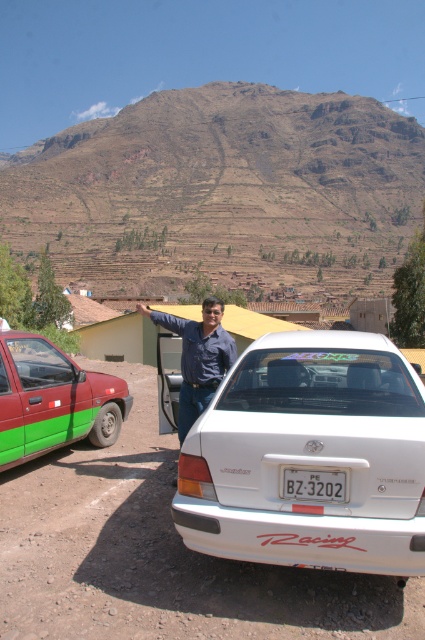
Can you confirm if green matte car at left is positioned to the left of white plastic license plate at center?

Indeed, green matte car at left is positioned on the left side of white plastic license plate at center.

Which is in front, point (25, 381) or point (283, 476)?

Point (283, 476)

The image size is (425, 640). I want to click on green matte car at left, so click(x=53, y=400).

Between blue denim shirt at center and white plastic license plate at center, which one appears on the right side from the viewer's perspective?

From the viewer's perspective, white plastic license plate at center appears more on the right side.

Does blue denim shirt at center appear on the left side of white plastic license plate at center?

Indeed, blue denim shirt at center is positioned on the left side of white plastic license plate at center.

Which is in front, point (178, 424) or point (283, 481)?

Point (283, 481)

Where is `blue denim shirt at center`? Image resolution: width=425 pixels, height=640 pixels. blue denim shirt at center is located at coordinates (198, 356).

From the picture: Who is higher up, white glossy sedan at center or green matte car at left?

Positioned higher is white glossy sedan at center.

Between white glossy sedan at center and green matte car at left, which one appears on the left side from the viewer's perspective?

green matte car at left

Between point (340, 550) and point (48, 369), which one is positioned in front?

Point (340, 550) is more forward.

The image size is (425, 640). What are the coordinates of `white glossy sedan at center` in the screenshot? It's located at (309, 456).